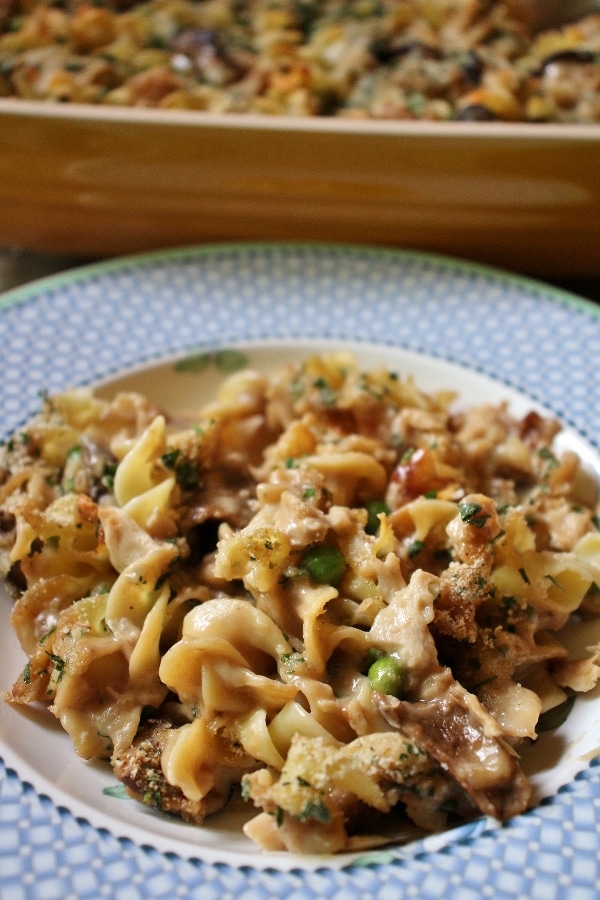
You are a GUI agent. You are given a task and a screenshot of the screen. Output one action in this format:
    pyautogui.click(x=<x>, y=<y>)
    Task: Click on the brown dish
    
    Given the screenshot: What is the action you would take?
    pyautogui.click(x=84, y=194)